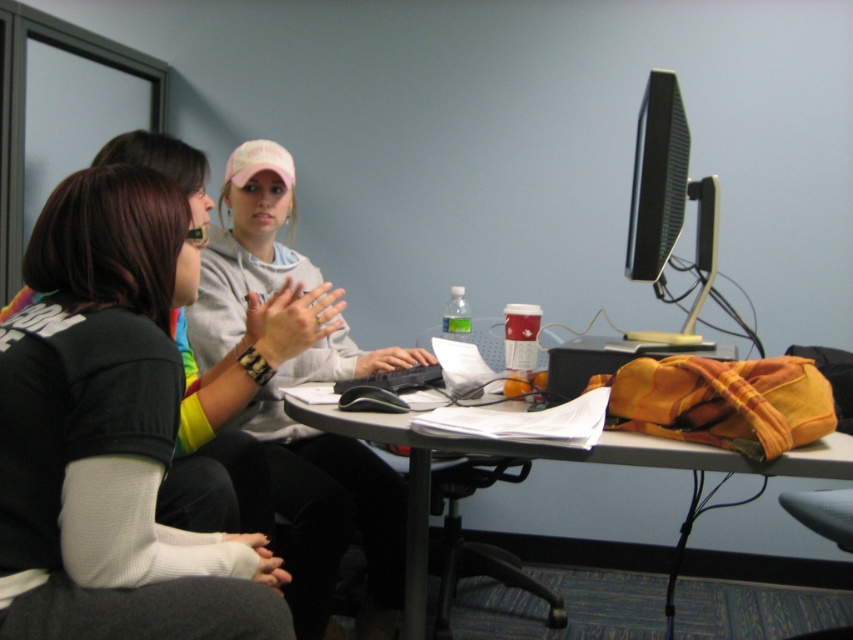
Image resolution: width=853 pixels, height=640 pixels. I want to click on black fabric shirt at left, so click(x=102, y=410).

Can you confirm if black fabric shirt at left is smaller than black glossy monitor at upper right?

Incorrect, black fabric shirt at left is not smaller in size than black glossy monitor at upper right.

Image resolution: width=853 pixels, height=640 pixels. I want to click on black fabric shirt at left, so [102, 410].

Is the position of black fabric shirt at left more distant than that of orange fabric bag at center?

No, it is not.

Is black fabric shirt at left above orange fabric bag at center?

Yes.

Which is behind, point (115, 205) or point (408, 532)?

The point (408, 532) is more distant.

You are a GUI agent. You are given a task and a screenshot of the screen. Output one action in this format:
    pyautogui.click(x=<x>, y=<y>)
    Task: Click on the black fabric shirt at left
    The height and width of the screenshot is (640, 853).
    Given the screenshot: What is the action you would take?
    pyautogui.click(x=102, y=410)

Locate an element on the screen. This screenshot has height=640, width=853. orange fabric bag at center is located at coordinates (550, 460).

The width and height of the screenshot is (853, 640). Find the location of `orange fabric bag at center`. orange fabric bag at center is located at coordinates [550, 460].

Locate an element on the screen. orange fabric bag at center is located at coordinates click(550, 460).